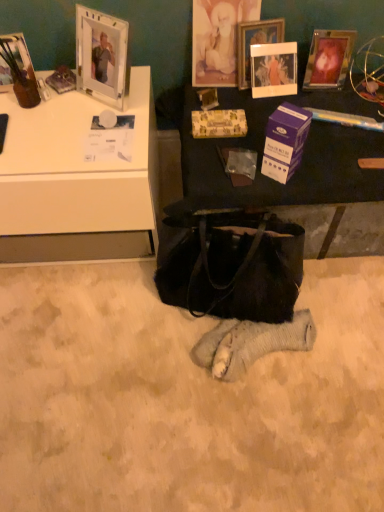
The height and width of the screenshot is (512, 384). In order to click on spots to the right of gold-patterned paper at center in this screenshot , I will do `click(268, 114)`.